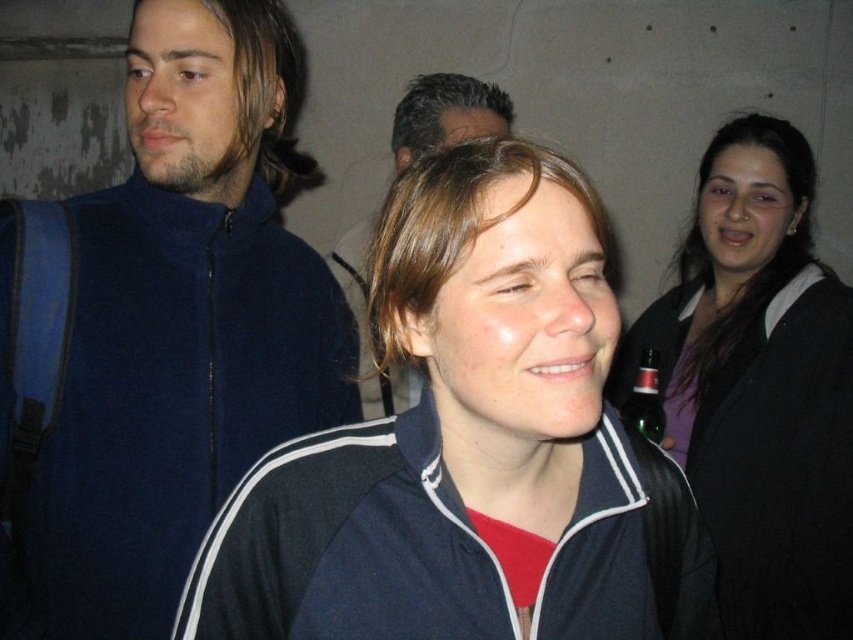
You are at a party and need to grab the green glass bottle at right to serve drinks. The matte black jacket at right is in your way. Can you reach the bottle without moving the jacket?

The matte black jacket at right is 7.97 inches away from the green glass bottle at right. Since the distance is relatively small, you can likely reach the bottle without moving the jacket by carefully extending your arm between them.

You are at a park and see the dark blue fleece at center and the green glass bottle at right. Which object is located to the right of the other?

The dark blue fleece at center is positioned on the left side of green glass bottle at right, so the green glass bottle at right is to the right of the dark blue fleece at center.

You are standing at point (469, 115) and want to walk to point (502, 440). Is there a clear path between these two points?

Yes, since point (502, 440) is in front of point (469, 115), there is a clear path between them.